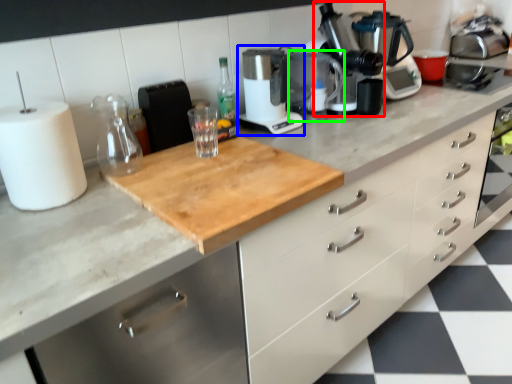
Question: Considering the real-world distances, which object is closest to coffee machine (highlighted by a red box)? kitchen appliance (highlighted by a blue box) or appliance (highlighted by a green box).

Choices:
 (A) kitchen appliance
 (B) appliance

Answer: (B)